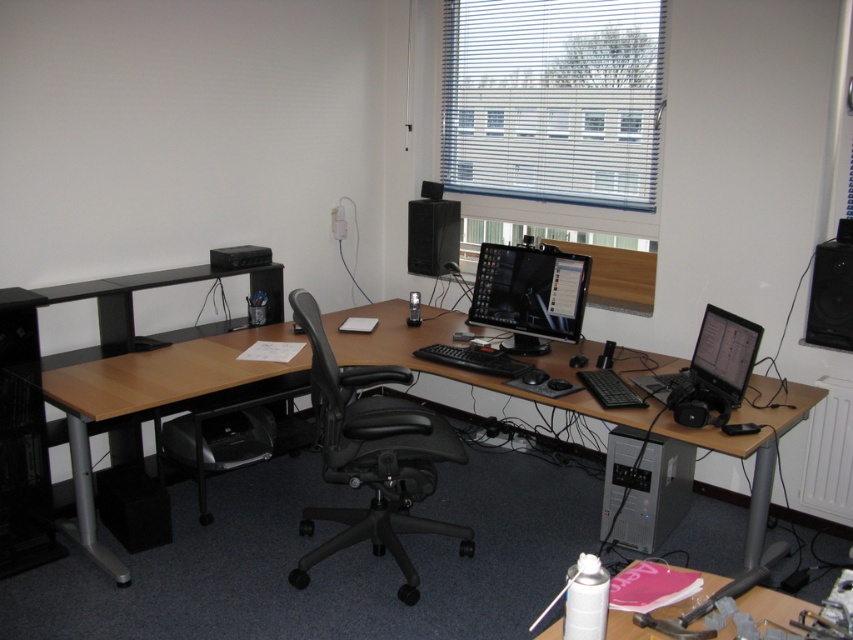
Question: Which of these objects is positioned farthest from the white plastic blinds at upper center?

Choices:
 (A) black plastic speaker at upper center
 (B) matte black monitor at center

Answer: (B)

Question: Does black matte laptop at center appear on the left side of black plastic speaker at upper center?

Choices:
 (A) no
 (B) yes

Answer: (A)

Question: Among these objects, which one is nearest to the camera?

Choices:
 (A) black plastic speaker at upper center
 (B) wooden desk at center
 (C) white plastic blinds at upper center

Answer: (B)

Question: Does black matte laptop at center appear on the right side of white plastic spray can at lower right?

Choices:
 (A) no
 (B) yes

Answer: (B)

Question: Can you confirm if wooden desk at center is wider than black plastic speaker at right?

Choices:
 (A) yes
 (B) no

Answer: (A)

Question: Which object is the closest to the white plastic spray can at lower right?

Choices:
 (A) black plastic speaker at upper center
 (B) wooden desk at center
 (C) black plastic printer at lower left
 (D) black plastic speaker at right

Answer: (B)